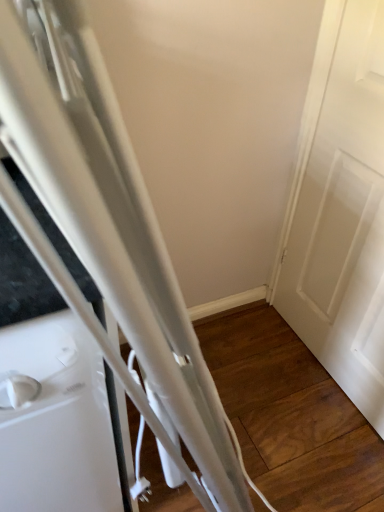
Question: From the image's perspective, is white matte door at right above or below white glossy refrigerator at left?

Choices:
 (A) below
 (B) above

Answer: (B)

Question: Looking at their shapes, would you say white matte door at right is wider or thinner than white glossy refrigerator at left?

Choices:
 (A) thin
 (B) wide

Answer: (A)

Question: Considering the positions of point (380, 32) and point (26, 289), is point (380, 32) closer or farther from the camera than point (26, 289)?

Choices:
 (A) closer
 (B) farther

Answer: (B)

Question: From the image's perspective, is white glossy refrigerator at left above or below white matte door at right?

Choices:
 (A) below
 (B) above

Answer: (A)

Question: Is white glossy refrigerator at left wider or thinner than white matte door at right?

Choices:
 (A) thin
 (B) wide

Answer: (B)

Question: Considering the positions of white glossy refrigerator at left and white matte door at right in the image, is white glossy refrigerator at left bigger or smaller than white matte door at right?

Choices:
 (A) big
 (B) small

Answer: (A)

Question: Does point (41, 224) appear closer or farther from the camera than point (319, 206)?

Choices:
 (A) closer
 (B) farther

Answer: (A)